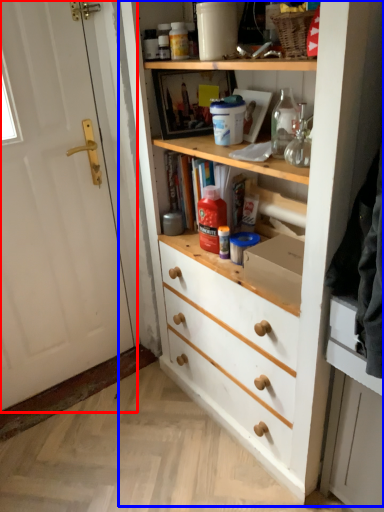
Question: Which point is further to the camera, door (highlighted by a red box) or cupboard (highlighted by a blue box)?

Choices:
 (A) door
 (B) cupboard

Answer: (A)